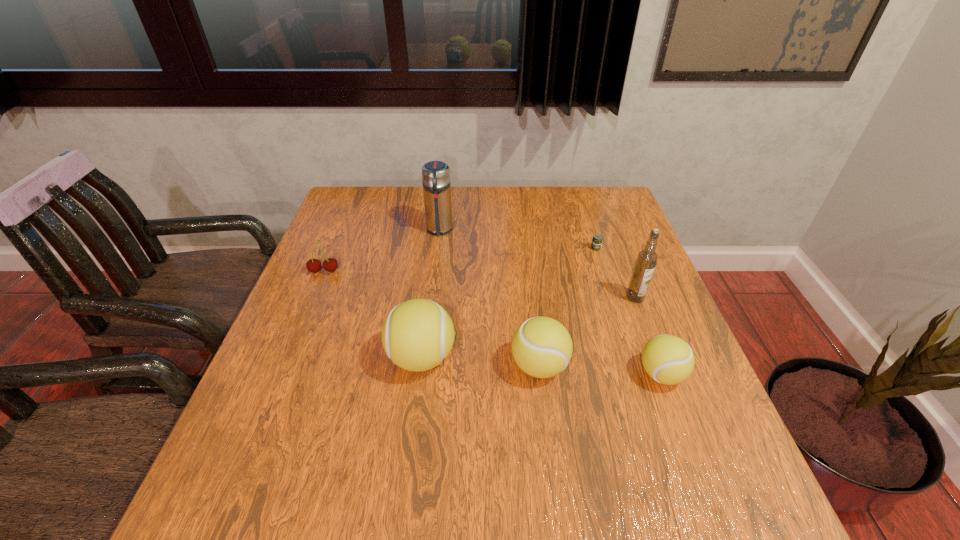
The image size is (960, 540). What are the coordinates of `vacant area in the image that satisfies the following two spatial constraints: 1. with a handle on the side of the farthest object; 2. on the left side of the rightmost tennis ball` in the screenshot? It's located at (422, 375).

The height and width of the screenshot is (540, 960). In order to click on free space that satisfies the following two spatial constraints: 1. with a handle on the side of the farthest object; 2. on the right side of the rightmost tennis ball in this screenshot , I will do `click(422, 375)`.

The width and height of the screenshot is (960, 540). In order to click on blank space that satisfies the following two spatial constraints: 1. on the surface of the leftmost object; 2. on the left side of the tallest tennis ball in this screenshot , I will do 288,358.

Where is `vacant space that satisfies the following two spatial constraints: 1. with a handle on the side of the thermos bottle; 2. on the left side of the second shortest tennis ball`? This screenshot has width=960, height=540. vacant space that satisfies the following two spatial constraints: 1. with a handle on the side of the thermos bottle; 2. on the left side of the second shortest tennis ball is located at coordinates (423, 366).

You are a GUI agent. You are given a task and a screenshot of the screen. Output one action in this format:
    pyautogui.click(x=<x>, y=<y>)
    Task: Click on the vacant region that satisfies the following two spatial constraints: 1. with a handle on the side of the shortest object; 2. on the right side of the farthest object
    
    Given the screenshot: What is the action you would take?
    pyautogui.click(x=437, y=248)